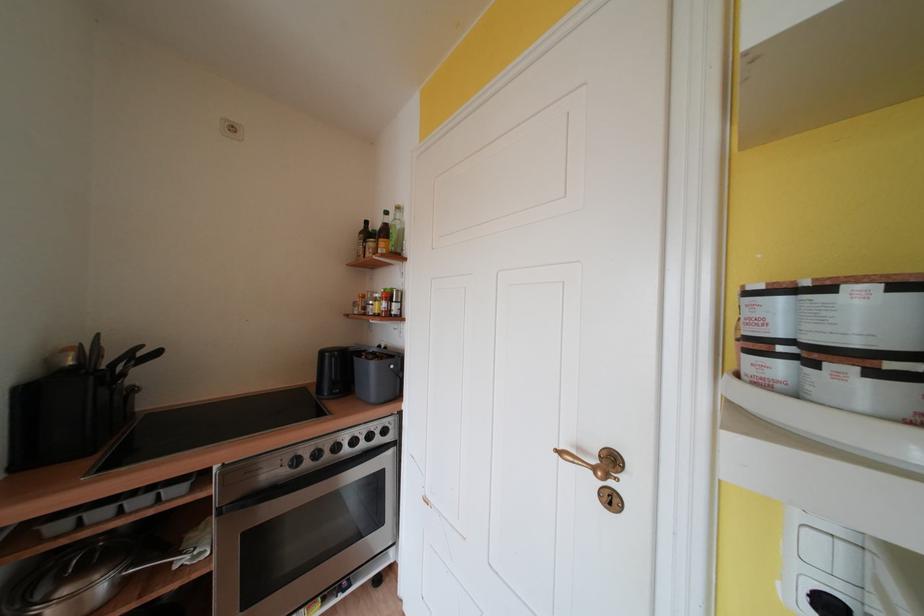
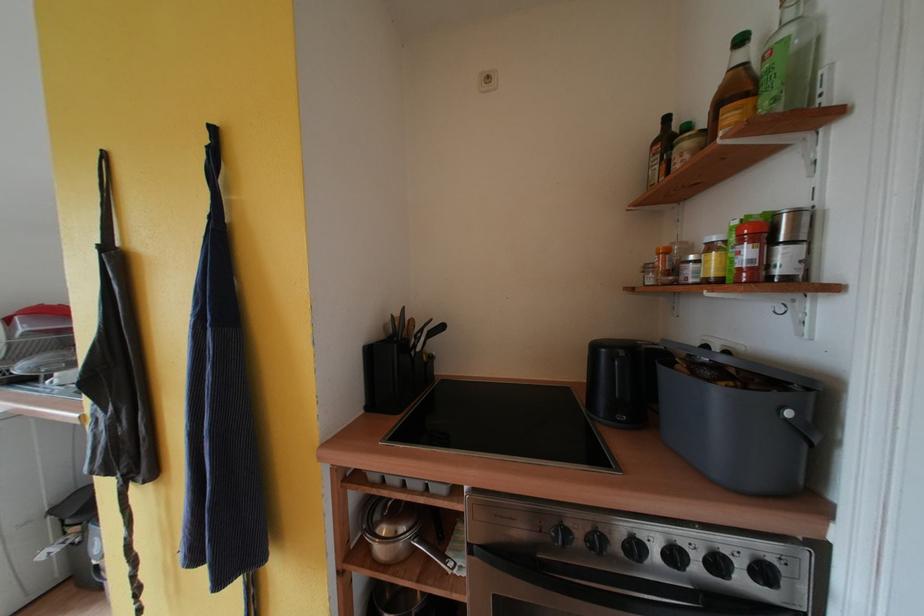
In the second image, find the point that corresponds to (391,435) in the first image.

(771, 577)